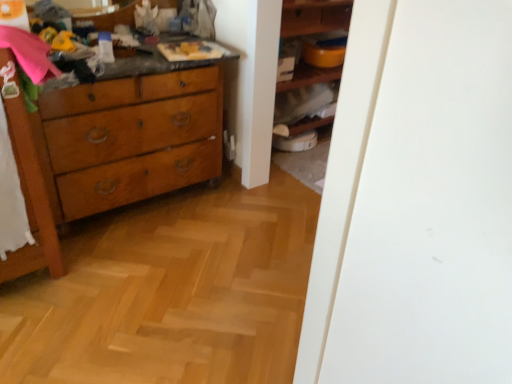
Question: Considering the positions of point (10, 102) and point (309, 1), is point (10, 102) closer or farther from the camera than point (309, 1)?

Choices:
 (A) closer
 (B) farther

Answer: (A)

Question: Would you say wooden dresser at left is to the left or to the right of wooden shelves at center in the picture?

Choices:
 (A) left
 (B) right

Answer: (A)

Question: Estimate the real-world distances between objects in this image. Which object is closer to the wooden cabinet at center?

Choices:
 (A) wooden dresser at left
 (B) wooden shelves at center

Answer: (B)

Question: Which of these objects is positioned farthest from the wooden shelves at center?

Choices:
 (A) wooden dresser at left
 (B) wooden cabinet at center

Answer: (A)